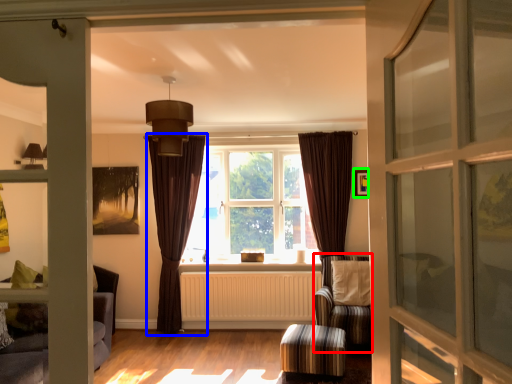
Question: Based on their relative distances, which object is farther from armchair (highlighted by a red box)? Choose from curtain (highlighted by a blue box) and picture frame (highlighted by a green box).

Choices:
 (A) curtain
 (B) picture frame

Answer: (A)